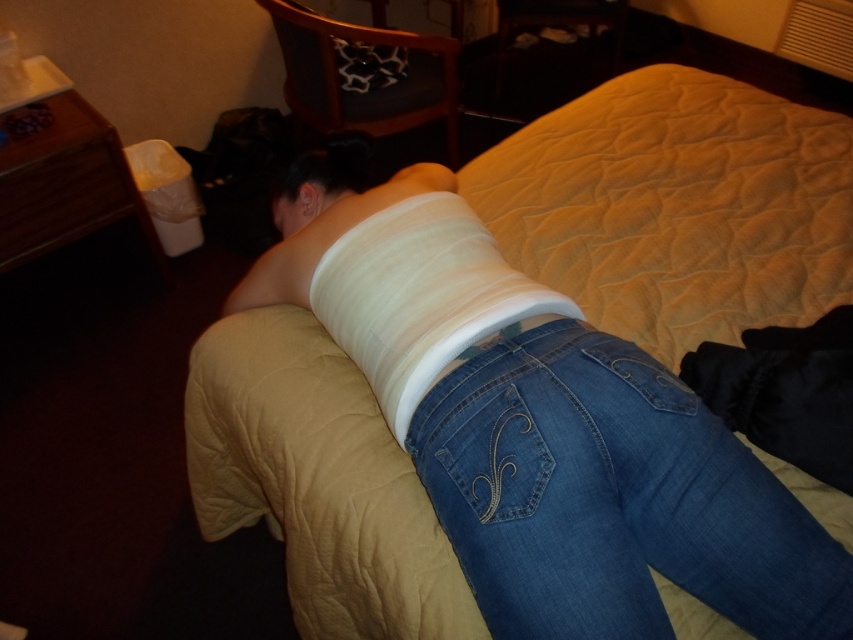
Can you confirm if beige quilted bed at center is positioned to the right of white fabric bandage at center?

Correct, you'll find beige quilted bed at center to the right of white fabric bandage at center.

Locate an element on the screen. The height and width of the screenshot is (640, 853). beige quilted bed at center is located at coordinates (677, 205).

Can you confirm if beige quilted bed at center is positioned to the left of denim at center?

Incorrect, beige quilted bed at center is not on the left side of denim at center.

Which is above, beige quilted bed at center or denim at center?

beige quilted bed at center

What do you see at coordinates (677, 205) in the screenshot? I see `beige quilted bed at center` at bounding box center [677, 205].

At what (x,y) coordinates should I click in order to perform the action: click on beige quilted bed at center. Please return your answer as a coordinate pair (x, y). The image size is (853, 640). Looking at the image, I should click on (677, 205).

Does denim at center come behind white fabric bandage at center?

No, it is in front of white fabric bandage at center.

Image resolution: width=853 pixels, height=640 pixels. What are the coordinates of `denim at center` in the screenshot? It's located at [x=613, y=499].

This screenshot has width=853, height=640. What do you see at coordinates (613, 499) in the screenshot?
I see `denim at center` at bounding box center [613, 499].

What are the coordinates of `denim at center` in the screenshot? It's located at point(613,499).